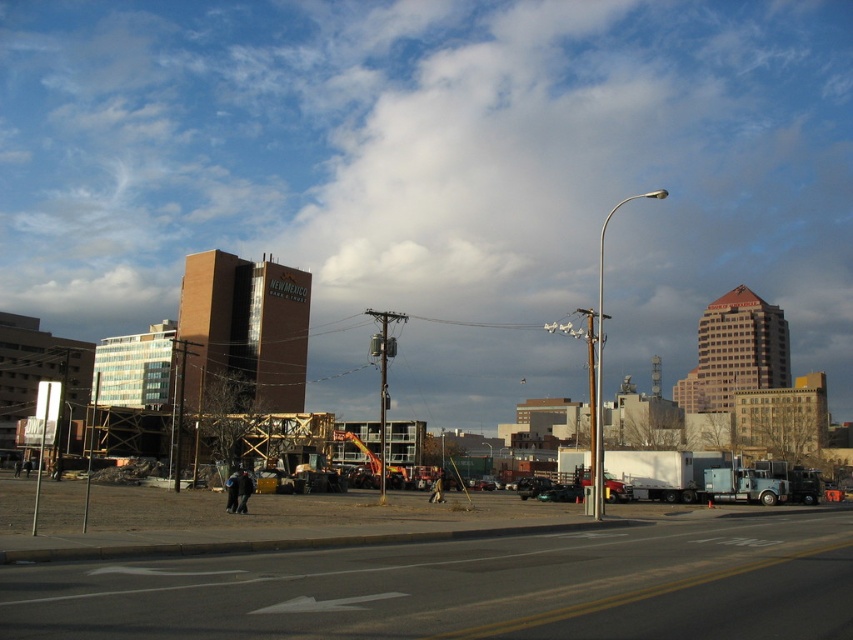
Does brown wooden construction site at center appear over metallic silver truck at center?

Correct, brown wooden construction site at center is located above metallic silver truck at center.

Is point (677, 532) farther from camera compared to point (531, 486)?

No.

Find the location of a particular element. The height and width of the screenshot is (640, 853). brown wooden construction site at center is located at coordinates (473, 586).

Between brown wooden construction site at center and green matte car at center, which one is positioned higher?

brown wooden construction site at center is above.

Does brown wooden construction site at center have a greater width compared to green matte car at center?

Indeed, brown wooden construction site at center has a greater width compared to green matte car at center.

Does point (138, 636) lie in front of point (547, 490)?

Yes, point (138, 636) is closer to viewer.

Locate an element on the screen. The height and width of the screenshot is (640, 853). brown wooden construction site at center is located at coordinates (473, 586).

Does green matte car at center have a lesser height compared to metallic silver truck at center?

Yes, green matte car at center is shorter than metallic silver truck at center.

Does green matte car at center appear on the right side of metallic silver truck at center?

Correct, you'll find green matte car at center to the right of metallic silver truck at center.

Describe the element at coordinates (561, 493) in the screenshot. I see `green matte car at center` at that location.

This screenshot has width=853, height=640. I want to click on green matte car at center, so click(x=561, y=493).